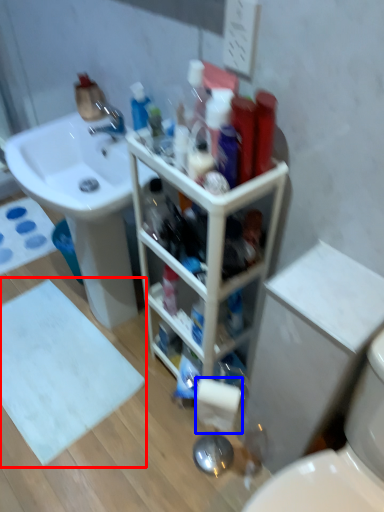
Question: Which of the following is the farthest to the observer, bath mat (highlighted by a red box) or toilet paper (highlighted by a blue box)?

Choices:
 (A) bath mat
 (B) toilet paper

Answer: (A)